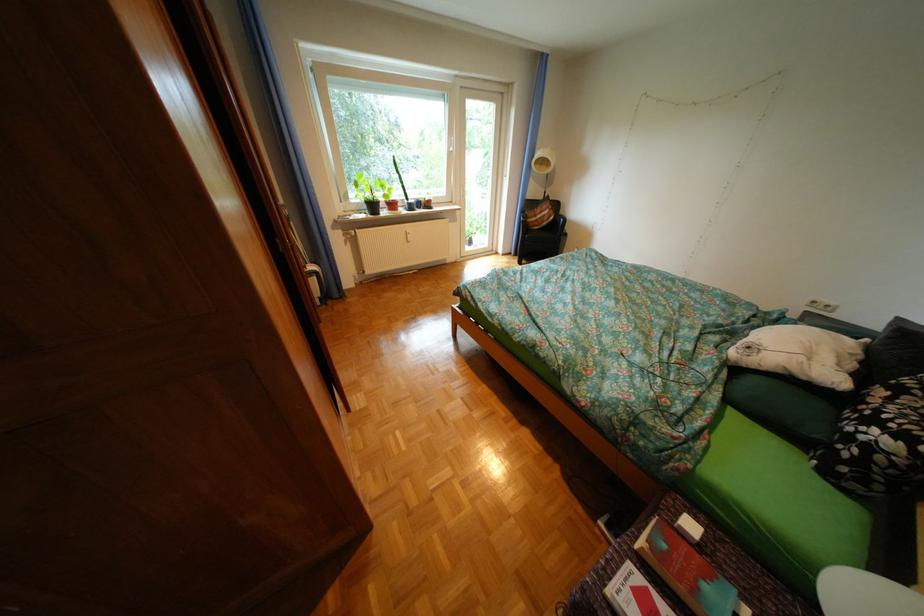
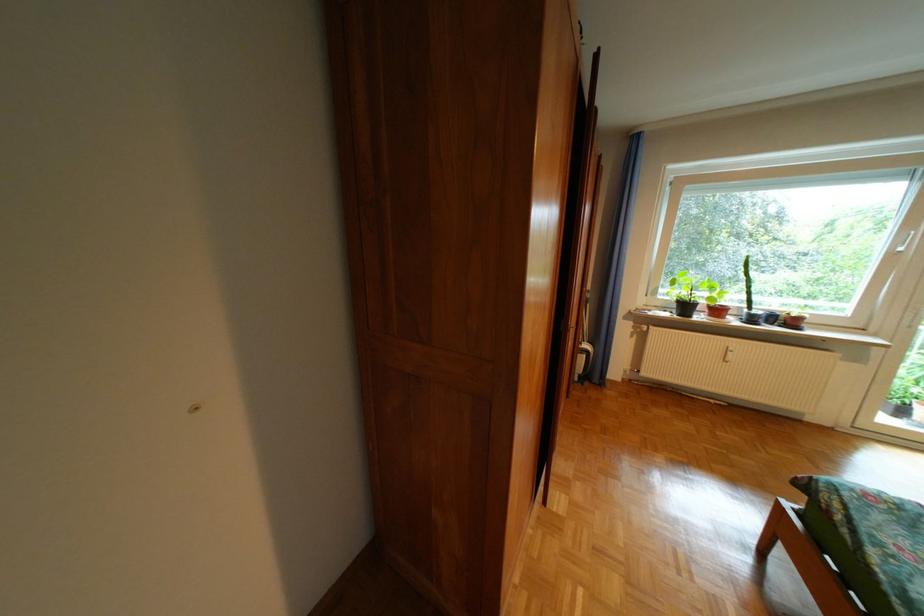
In the second image, find the point that corresponds to point 464,147 in the first image.

(912, 245)